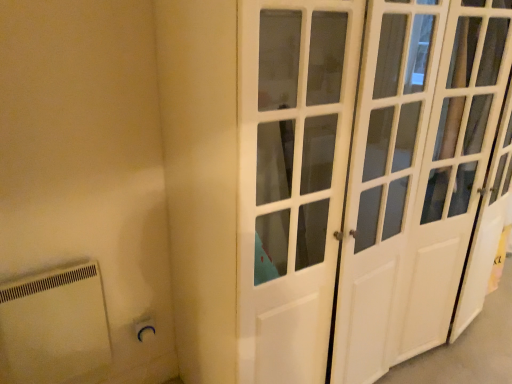
Where is `white plastic electric outlet at lower left`? The image size is (512, 384). white plastic electric outlet at lower left is located at coordinates (144, 328).

At what (x,y) coordinates should I click in order to perform the action: click on white plastic radiator at lower left. Please return your answer as a coordinate pair (x, y). Image resolution: width=512 pixels, height=384 pixels. Looking at the image, I should click on (54, 327).

The width and height of the screenshot is (512, 384). Identify the location of electric outlet on the right of white plastic radiator at lower left. (144, 328).

How many degrees apart are the facing directions of white plastic electric outlet at lower left and white plastic radiator at lower left?

0.00059 degrees separate the facing orientations of white plastic electric outlet at lower left and white plastic radiator at lower left.

Is white plastic electric outlet at lower left outside of white plastic radiator at lower left?

No, most part of white plastic electric outlet at lower left lies within white plastic radiator at lower left.

Consider the image. Is white plastic electric outlet at lower left to the left of white plastic radiator at lower left from the viewer's perspective?

No.

Which of these two, white plastic radiator at lower left or white plastic electric outlet at lower left, is bigger?

white plastic radiator at lower left.

Based on the photo, which is correct: white plastic radiator at lower left is inside white plastic electric outlet at lower left, or outside of it?

white plastic radiator at lower left lies outside white plastic electric outlet at lower left.

Considering their positions, is white plastic radiator at lower left located in front of or behind white plastic electric outlet at lower left?

white plastic radiator at lower left is in front of white plastic electric outlet at lower left.

Considering the relative sizes of white plastic radiator at lower left and white plastic electric outlet at lower left in the image provided, is white plastic radiator at lower left shorter than white plastic electric outlet at lower left?

No.

Is white plastic electric outlet at lower left at the back of white glossy door at center?

No, white glossy door at center is not facing the opposite direction of white plastic electric outlet at lower left.

Does white glossy door at center appear on the right side of white plastic electric outlet at lower left?

Yes.

From a real-world perspective, is white glossy door at center positioned over white plastic electric outlet at lower left based on gravity?

Correct, in the physical world, white glossy door at center is higher than white plastic electric outlet at lower left.

From the image's perspective, which is below, white glossy door at center or white plastic electric outlet at lower left?

white plastic electric outlet at lower left is shown below in the image.

Considering the sizes of objects white glossy door at center and white plastic radiator at lower left in the image provided, who is taller, white glossy door at center or white plastic radiator at lower left?

white glossy door at center is taller.

Is white glossy door at center thinner than white plastic radiator at lower left?

Incorrect, the width of white glossy door at center is not less than that of white plastic radiator at lower left.

Between white glossy door at center and white plastic radiator at lower left, which one is positioned in front?

white glossy door at center is in front.

Is white glossy door at center beside white plastic radiator at lower left?

white glossy door at center and white plastic radiator at lower left are not in contact.

How different are the orientations of white plastic radiator at lower left and white glossy door at center in degrees?

white plastic radiator at lower left and white glossy door at center are facing 1.15 degrees away from each other.

Would you say white glossy door at center is part of white plastic radiator at lower left's contents?

No, white glossy door at center is not inside white plastic radiator at lower left.

Does point (82, 297) come farther from viewer compared to point (224, 145)?

Yes, point (82, 297) is behind point (224, 145).

From a real-world perspective, which is physically below, white plastic radiator at lower left or white glossy door at center?

In real-world perspective, white plastic radiator at lower left is lower.

Between white plastic electric outlet at lower left and white glossy door at center, which one has larger width?

With larger width is white glossy door at center.

Consider the image. Is white plastic electric outlet at lower left not near white glossy door at center?

That's not correct — white plastic electric outlet at lower left is a little close to white glossy door at center.

Consider the image. Which object is closer to the camera, white plastic electric outlet at lower left or white glossy door at center?

white glossy door at center is in front.

Identify the location of appliance lying in front of the white plastic electric outlet at lower left. (54, 327).

Where is `appliance on the left of white plastic electric outlet at lower left`? The height and width of the screenshot is (384, 512). appliance on the left of white plastic electric outlet at lower left is located at coordinates (54, 327).

When comparing their distances from white glossy door at center, does white plastic radiator at lower left or white plastic electric outlet at lower left seem closer?

Based on the image, white plastic radiator at lower left appears to be nearer to white glossy door at center.

Consider the image. Based on their spatial positions, is white plastic radiator at lower left or white glossy door at center further from white plastic electric outlet at lower left?

white glossy door at center is further to white plastic electric outlet at lower left.

When comparing their distances from white glossy door at center, does white plastic electric outlet at lower left or white plastic radiator at lower left seem further?

Among the two, white plastic electric outlet at lower left is located further to white glossy door at center.

Which object lies further to the anchor point white plastic radiator at lower left, white plastic electric outlet at lower left or white glossy door at center?

white glossy door at center is further to white plastic radiator at lower left.

Which object lies further to the anchor point white plastic electric outlet at lower left, white glossy door at center or white plastic radiator at lower left?

white glossy door at center is positioned further to the anchor white plastic electric outlet at lower left.

When comparing their distances from white plastic radiator at lower left, does white glossy door at center or white plastic electric outlet at lower left seem further?

Based on the image, white glossy door at center appears to be further to white plastic radiator at lower left.

You are a GUI agent. You are given a task and a screenshot of the screen. Output one action in this format:
    pyautogui.click(x=<x>, y=<y>)
    Task: Click on the electric outlet between white plastic radiator at lower left and white glossy door at center from left to right
    This screenshot has width=512, height=384.
    Given the screenshot: What is the action you would take?
    pyautogui.click(x=144, y=328)